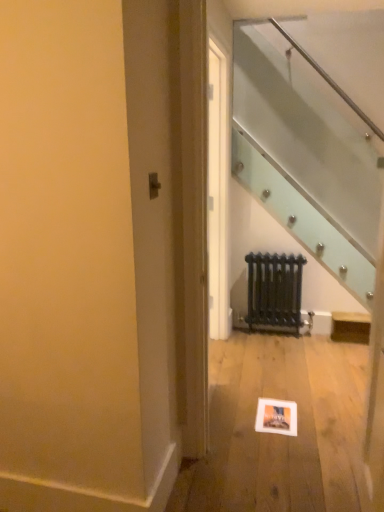
The height and width of the screenshot is (512, 384). In order to click on free spot behind matte orange picture frame at lower center in this screenshot , I will do `click(266, 387)`.